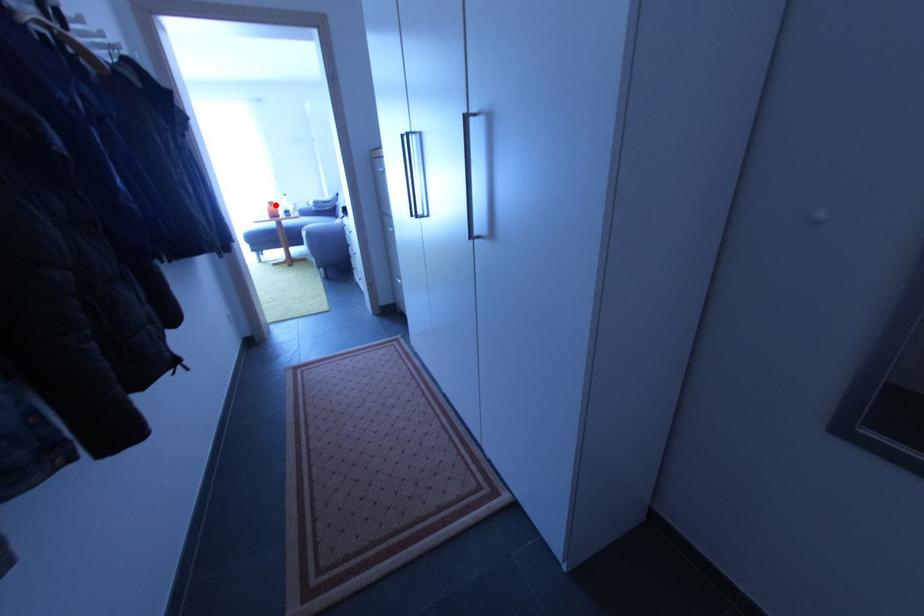
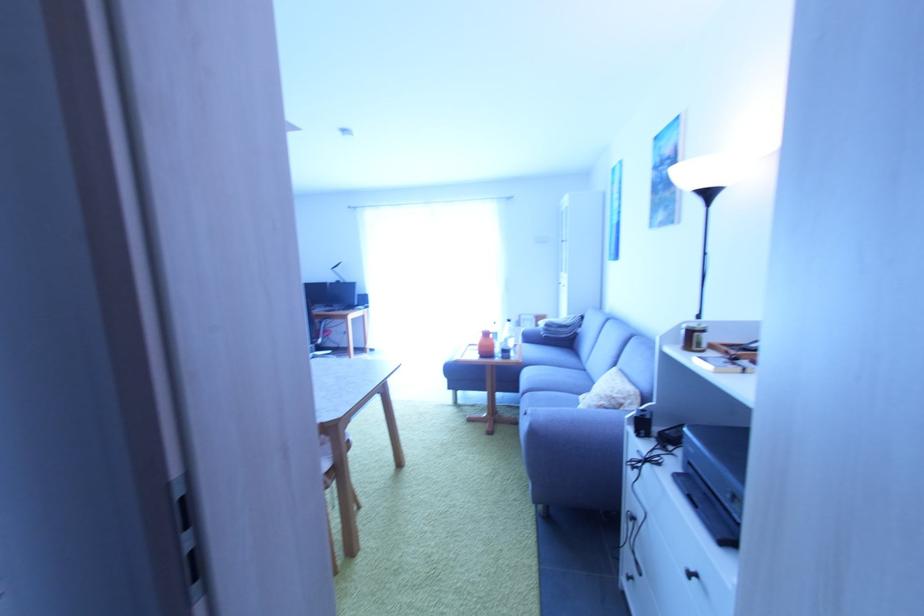
In the second image, find the point that corresponds to the highlighted location in the first image.

(492, 336)